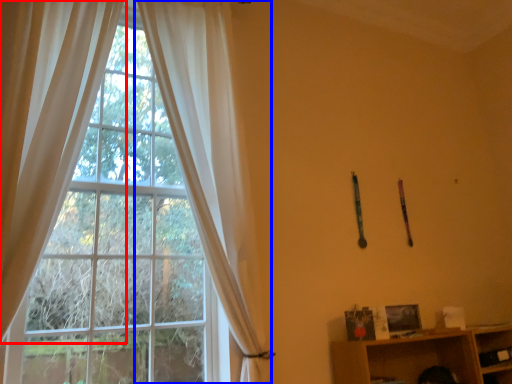
Question: Which object is further to the camera taking this photo, curtain (highlighted by a red box) or curtain (highlighted by a blue box)?

Choices:
 (A) curtain
 (B) curtain

Answer: (B)